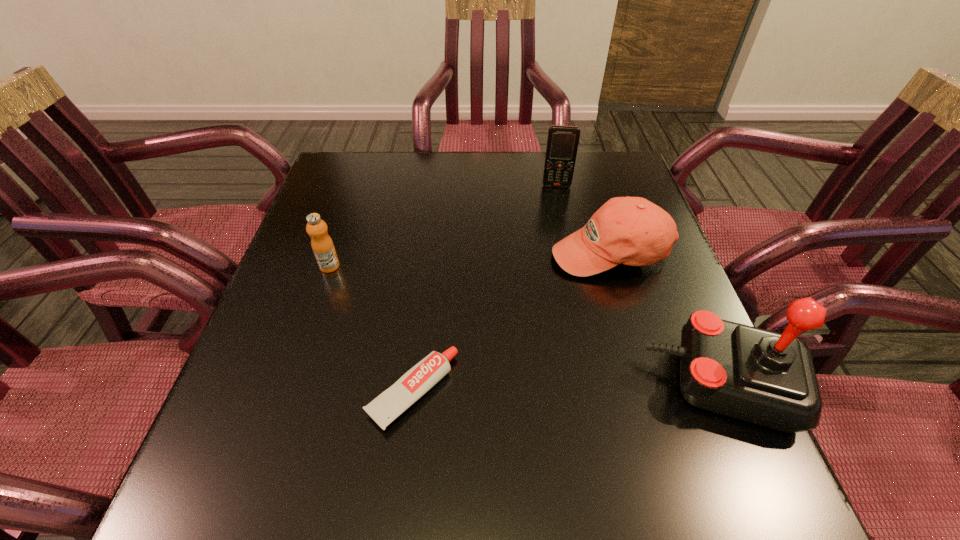
I want to click on vacant region at the far right corner of the desktop, so click(629, 170).

At what (x,y) coordinates should I click in order to perform the action: click on free space that is in between the fourth shortest object and the leftmost object. Please return your answer as a coordinate pair (x, y). Image resolution: width=960 pixels, height=540 pixels. Looking at the image, I should click on (444, 226).

Locate an element on the screen. Image resolution: width=960 pixels, height=540 pixels. empty location between the cellular telephone and the orange juice is located at coordinates (444, 226).

Locate an element on the screen. This screenshot has width=960, height=540. free spot between the baseball cap and the fourth shortest object is located at coordinates (583, 219).

Locate an element on the screen. The image size is (960, 540). free point between the fourth object from right to left and the orange juice is located at coordinates (372, 329).

In order to click on blank region between the joystick and the baseball cap in this screenshot , I will do `click(667, 318)`.

Find the location of a particular element. The height and width of the screenshot is (540, 960). free space between the baseball cap and the fourth shortest object is located at coordinates (583, 219).

Image resolution: width=960 pixels, height=540 pixels. Identify the location of free point between the toothpaste and the leftmost object. (372, 329).

Where is `blank region between the baseball cap and the tallest object`? blank region between the baseball cap and the tallest object is located at coordinates (667, 318).

Where is `empty space that is in between the baseball cap and the shortest object`? This screenshot has height=540, width=960. empty space that is in between the baseball cap and the shortest object is located at coordinates (511, 322).